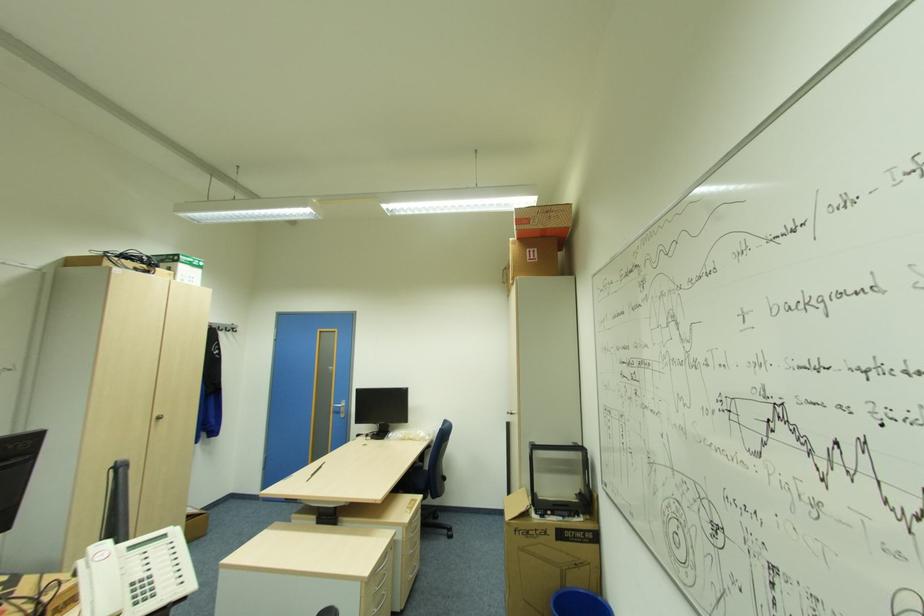
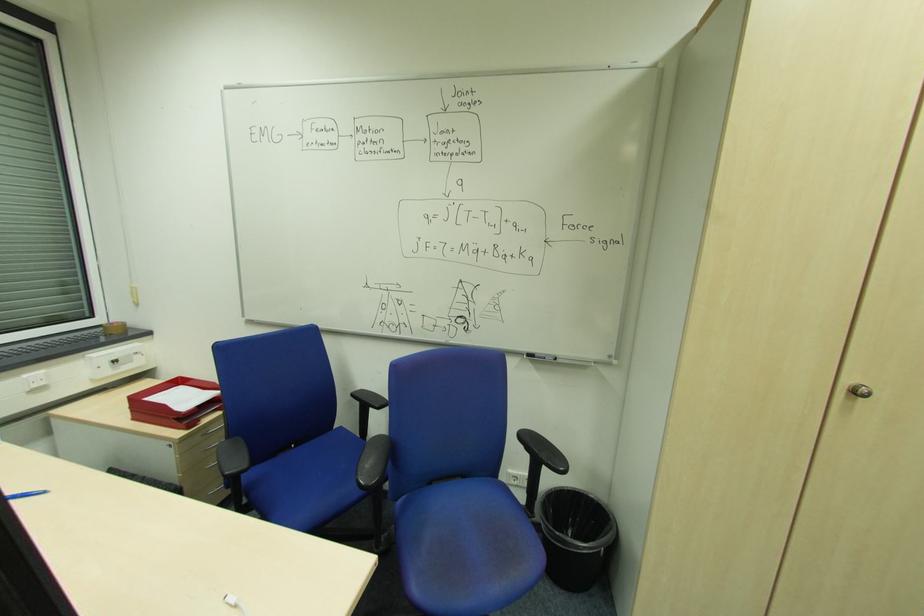
Find the pixel in the second image that matches pixel 162 418 in the first image.

(860, 392)